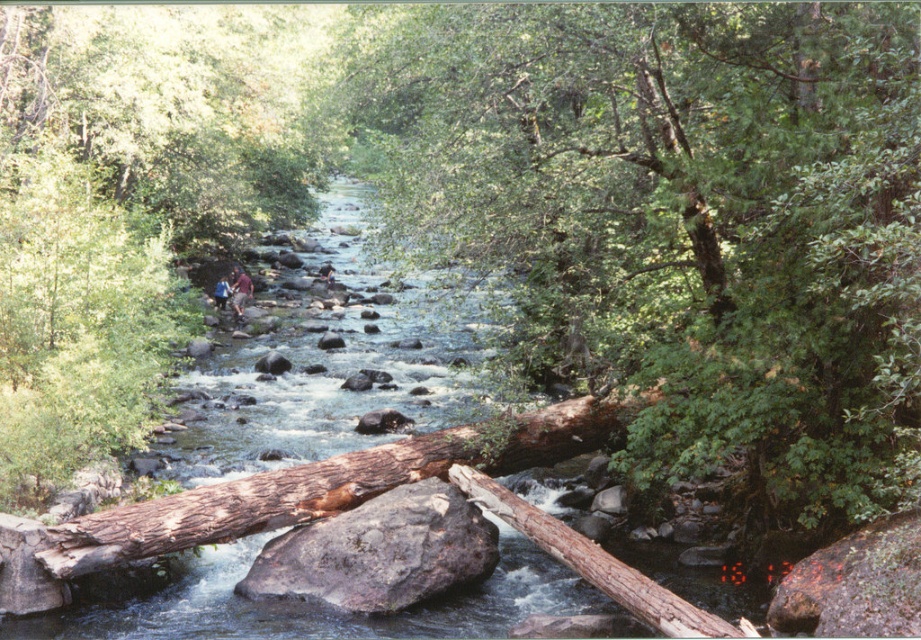
Question: Based on their relative distances, which object is farther from the smooth brown log at center?

Choices:
 (A) brown leather jacket at center
 (B) brown rough rock at center

Answer: (A)

Question: Can you confirm if smooth brown log at center is thinner than brown leather jacket at center?

Choices:
 (A) no
 (B) yes

Answer: (A)

Question: Does smooth brown log at center come behind brown leather jacket at upper center?

Choices:
 (A) no
 (B) yes

Answer: (A)

Question: Among these points, which one is nearest to the camera?

Choices:
 (A) (759, 298)
 (B) (239, 284)

Answer: (A)

Question: Can you confirm if smooth brown log at center is thinner than brown leather jacket at upper center?

Choices:
 (A) no
 (B) yes

Answer: (A)

Question: Among these objects, which one is nearest to the camera?

Choices:
 (A) smooth brown log at center
 (B) brown rough rock at center
 (C) brown leather jacket at center

Answer: (A)